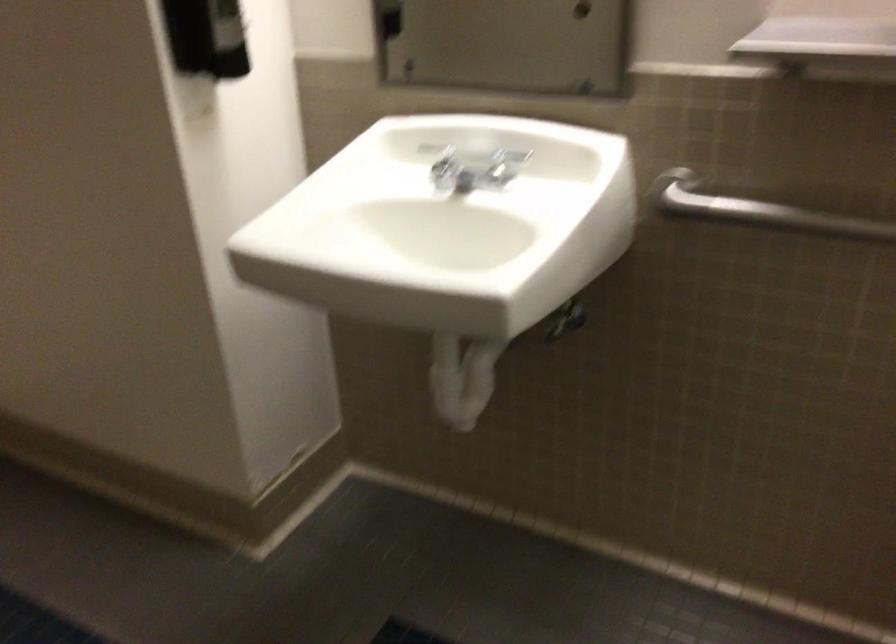
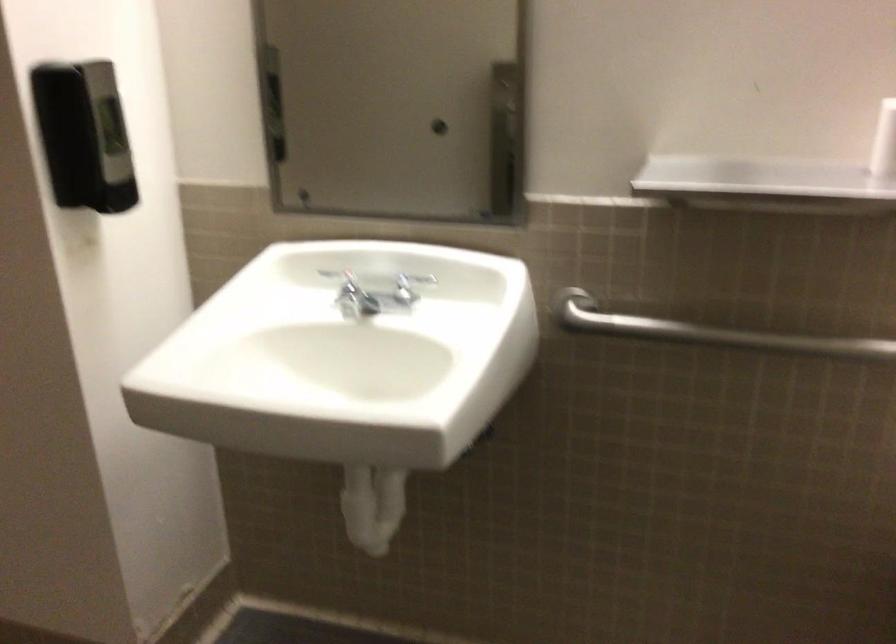
In the second image, find the point that corresponds to pixel 500 167 in the first image.

(403, 290)